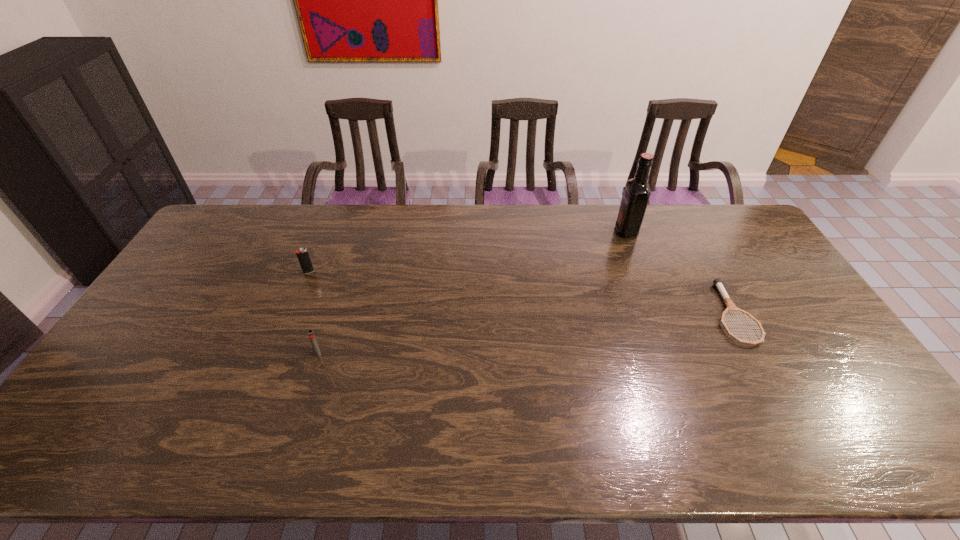
The height and width of the screenshot is (540, 960). I want to click on free area in between the liquor and the rightmost object, so click(679, 272).

Locate an element on the screen. Image resolution: width=960 pixels, height=540 pixels. vacant area between the nearer igniter and the farther igniter is located at coordinates (314, 313).

Locate an element on the screen. object that is the second closest to the right igniter is located at coordinates (637, 192).

Identify the location of object that is the closest to the right igniter. (302, 254).

Image resolution: width=960 pixels, height=540 pixels. What are the coordinates of `free space that satisfies the following two spatial constraints: 1. on the front side of the third nearest object; 2. on the right side of the shortest object` in the screenshot? It's located at (292, 314).

At what (x,y) coordinates should I click in order to perform the action: click on free location that satisfies the following two spatial constraints: 1. on the back side of the tennis racket; 2. on the left side of the nearest object. Please return your answer as a coordinate pair (x, y). The width and height of the screenshot is (960, 540). Looking at the image, I should click on (331, 314).

Where is `free space that satisfies the following two spatial constraints: 1. on the front-facing side of the liquor; 2. on the right side of the tennis racket`? free space that satisfies the following two spatial constraints: 1. on the front-facing side of the liquor; 2. on the right side of the tennis racket is located at coordinates (658, 314).

This screenshot has width=960, height=540. I want to click on vacant space that satisfies the following two spatial constraints: 1. on the back side of the right igniter; 2. on the right side of the shortest object, so click(x=331, y=314).